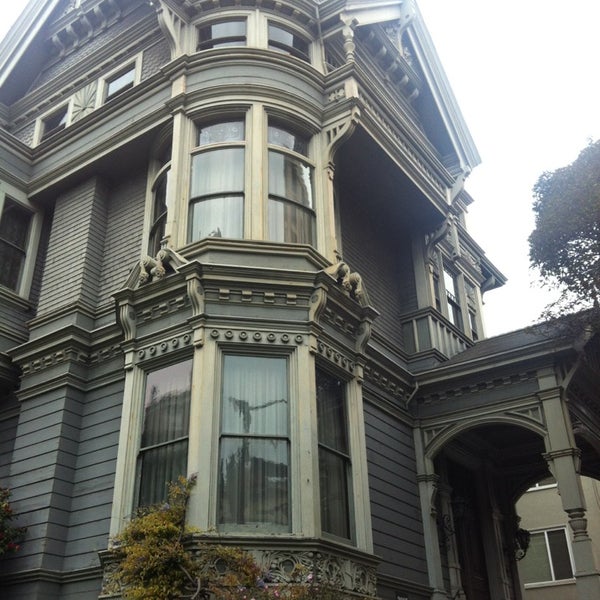
Identify the location of pillar. (567, 480).